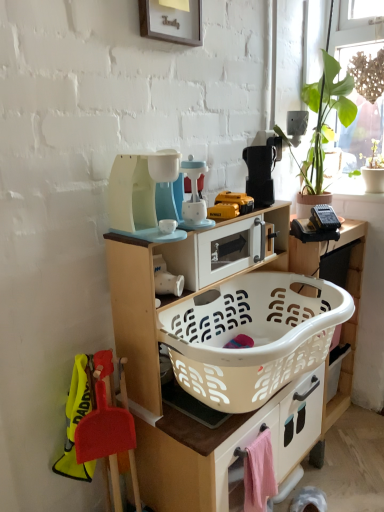
Question: Should I look upward or downward to see green leafy plant at upper right?

Choices:
 (A) down
 (B) up

Answer: (B)

Question: Is green leafy plant at upper right next to white plastic microwave at center, the second appliance in the right-to-left sequence, and touching it?

Choices:
 (A) yes
 (B) no

Answer: (B)

Question: Is green leafy plant at upper right oriented away from white plastic microwave at center, arranged as the 3th appliance when viewed from the left?

Choices:
 (A) no
 (B) yes

Answer: (A)

Question: Considering the relative sizes of green leafy plant at upper right and white plastic microwave at center, arranged as the 3th appliance when viewed from the left, in the image provided, is green leafy plant at upper right shorter than white plastic microwave at center, arranged as the 3th appliance when viewed from the left,?

Choices:
 (A) yes
 (B) no

Answer: (B)

Question: From a real-world perspective, does green leafy plant at upper right stand above white plastic microwave at center, the second appliance in the right-to-left sequence?

Choices:
 (A) no
 (B) yes

Answer: (B)

Question: From a real-world perspective, is green leafy plant at upper right beneath white plastic microwave at center, arranged as the 3th appliance when viewed from the left?

Choices:
 (A) no
 (B) yes

Answer: (A)

Question: From the image's perspective, is green leafy plant at upper right beneath white plastic microwave at center, arranged as the 3th appliance when viewed from the left?

Choices:
 (A) no
 (B) yes

Answer: (A)

Question: Is white matte cup at center, positioned as the 2th appliance in left-to-right order, not within white plastic microwave at center, the second appliance in the right-to-left sequence?

Choices:
 (A) yes
 (B) no

Answer: (A)

Question: Considering the relative sizes of white matte cup at center, positioned as the 3th appliance in right-to-left order, and white plastic microwave at center, arranged as the 3th appliance when viewed from the left, in the image provided, is white matte cup at center, positioned as the 3th appliance in right-to-left order, taller than white plastic microwave at center, arranged as the 3th appliance when viewed from the left,?

Choices:
 (A) yes
 (B) no

Answer: (B)

Question: Is white matte cup at center, positioned as the 2th appliance in left-to-right order, closer to the viewer compared to white plastic microwave at center, arranged as the 3th appliance when viewed from the left?

Choices:
 (A) yes
 (B) no

Answer: (A)

Question: Does white matte cup at center, positioned as the 2th appliance in left-to-right order, have a lesser height compared to white plastic microwave at center, the second appliance in the right-to-left sequence?

Choices:
 (A) yes
 (B) no

Answer: (A)

Question: Is white plastic microwave at center, the second appliance in the right-to-left sequence, completely or partially inside white matte cup at center, positioned as the 2th appliance in left-to-right order?

Choices:
 (A) no
 (B) yes

Answer: (A)

Question: Does white matte cup at center, positioned as the 3th appliance in right-to-left order, have a greater width compared to white plastic microwave at center, the second appliance in the right-to-left sequence?

Choices:
 (A) yes
 (B) no

Answer: (B)

Question: From a real-world perspective, is matte plastic toy coffee maker at center, which is the 1th appliance from left to right, physically above woven wood screen at upper right?

Choices:
 (A) yes
 (B) no

Answer: (B)